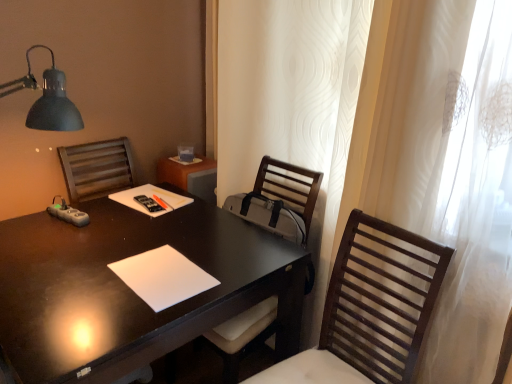
I want to click on vacant region above white matte notepad at center (from a real-world perspective), so click(x=158, y=264).